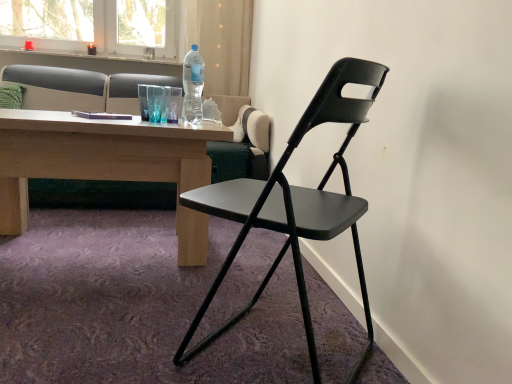
Question: Considering the relative sizes of green fabric pillow at upper left and matte gray studio couch at upper left in the image provided, is green fabric pillow at upper left bigger than matte gray studio couch at upper left?

Choices:
 (A) no
 (B) yes

Answer: (A)

Question: Is green fabric pillow at upper left facing away from matte gray studio couch at upper left?

Choices:
 (A) no
 (B) yes

Answer: (B)

Question: From a real-world perspective, is green fabric pillow at upper left on matte gray studio couch at upper left?

Choices:
 (A) yes
 (B) no

Answer: (A)

Question: Can you confirm if green fabric pillow at upper left is positioned to the left of matte gray studio couch at upper left?

Choices:
 (A) no
 (B) yes

Answer: (B)

Question: Is green fabric pillow at upper left beside matte gray studio couch at upper left?

Choices:
 (A) yes
 (B) no

Answer: (B)

Question: Can you confirm if green fabric pillow at upper left is thinner than matte gray studio couch at upper left?

Choices:
 (A) no
 (B) yes

Answer: (B)

Question: Does matte black folding chair at center have a lesser height compared to green fabric pillow at upper left?

Choices:
 (A) yes
 (B) no

Answer: (B)

Question: From a real-world perspective, is matte black folding chair at center on green fabric pillow at upper left?

Choices:
 (A) no
 (B) yes

Answer: (A)

Question: Is the surface of matte black folding chair at center in direct contact with green fabric pillow at upper left?

Choices:
 (A) yes
 (B) no

Answer: (B)

Question: Is matte black folding chair at center oriented towards green fabric pillow at upper left?

Choices:
 (A) no
 (B) yes

Answer: (B)

Question: Considering the relative sizes of matte black folding chair at center and green fabric pillow at upper left in the image provided, is matte black folding chair at center thinner than green fabric pillow at upper left?

Choices:
 (A) yes
 (B) no

Answer: (B)

Question: Is matte black folding chair at center smaller than green fabric pillow at upper left?

Choices:
 (A) no
 (B) yes

Answer: (A)

Question: Considering the relative sizes of matte gray studio couch at upper left and transparent plastic bottle at upper center in the image provided, is matte gray studio couch at upper left smaller than transparent plastic bottle at upper center?

Choices:
 (A) no
 (B) yes

Answer: (A)